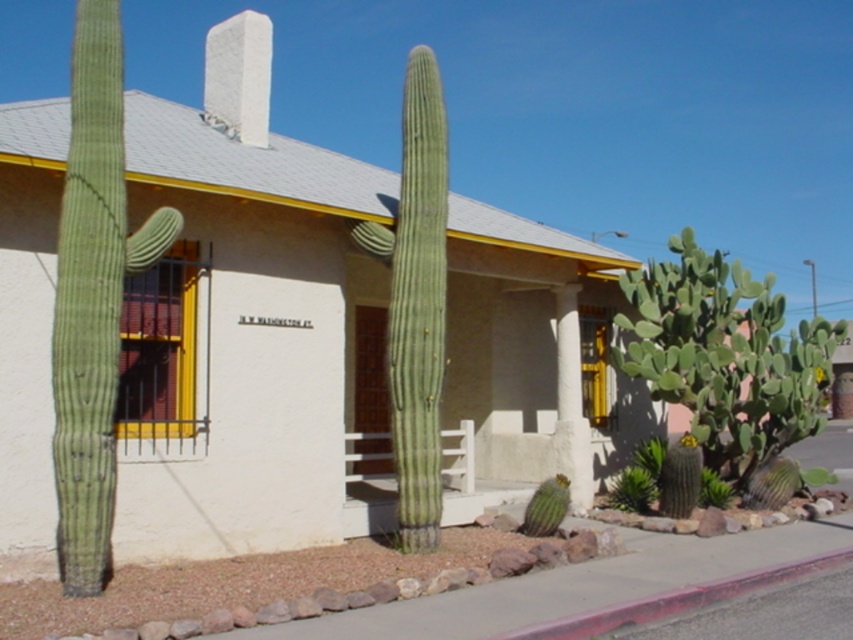
You are a gardener trying to plant a new cactus that requires a minimum of 2 meters of space between it and other plants. You see the green rough textured cactus at left and the green matte cactus at center. Which cactus has a width that is narrower than the other, allowing you to determine if there is enough space between them?

The green rough textured cactus at left has a width less than the green matte cactus at center. Since the rough textured cactus is narrower, you need to ensure the distance between them is at least 2 meters. However, the provided information does not specify the actual distance between the two cacti, so you cannot determine if there is enough space based solely on their widths.

You are a gardener wanting to plant a new cactus that requires more sunlight. You observe the green rough textured cactus at left and the green matte cactus at center. Which cactus is shorter and thus might receive more sunlight due to less obstruction?

The green rough textured cactus at left is shorter than the green matte cactus at center, so it might receive more sunlight as it is not as obstructed by the taller cactus.

You are standing at the entrance of the building and want to place a new plaque next to the existing plaque. The new plaque must be positioned exactly at point (93, 298). However, there is an object already present at this location. What object is blocking this point?

The green rough textured cactus at left is blocking the point (93, 298).